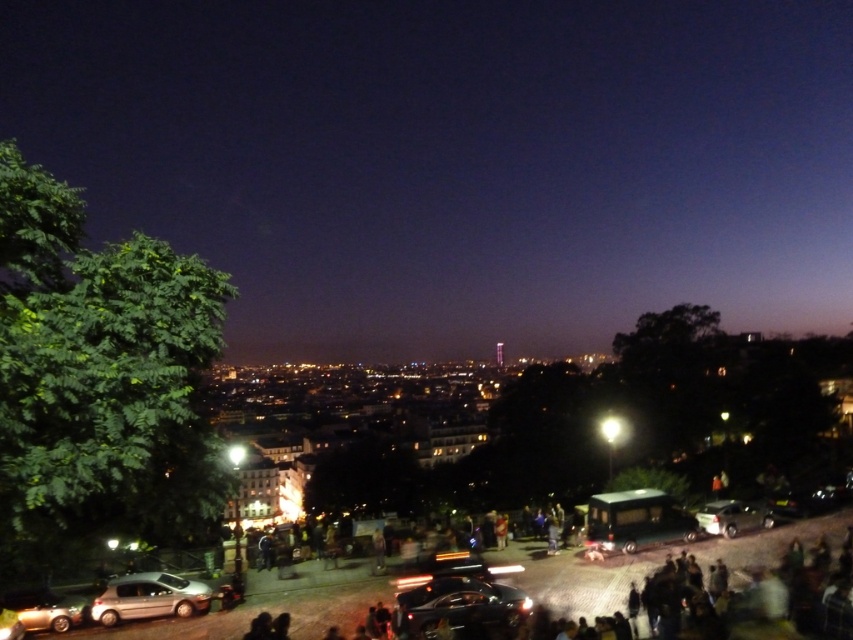
Looking at this image, does glossy black car at lower center have a greater width compared to silver metallic hatchback at lower left?

Indeed, glossy black car at lower center has a greater width compared to silver metallic hatchback at lower left.

Which is more to the right, glossy black car at lower center or silver metallic hatchback at lower left?

glossy black car at lower center is more to the right.

Which is behind, point (428, 634) or point (184, 580)?

The point (184, 580) is behind.

The width and height of the screenshot is (853, 640). Find the location of `glossy black car at lower center`. glossy black car at lower center is located at coordinates (456, 605).

Does silver metallic hatchback at lower left appear under metallic silver car at lower right?

Correct, silver metallic hatchback at lower left is located below metallic silver car at lower right.

Measure the distance from silver metallic hatchback at lower left to metallic silver car at lower right.

silver metallic hatchback at lower left is 45.97 meters away from metallic silver car at lower right.

Who is more distant from viewer, [206,592] or [727,529]?

Positioned behind is point [727,529].

This screenshot has width=853, height=640. I want to click on silver metallic hatchback at lower left, so click(149, 596).

Measure the distance between glossy black car at lower center and metallic silver car at lower right.

85.93 feet

Does glossy black car at lower center have a larger size compared to metallic silver car at lower right?

Correct, glossy black car at lower center is larger in size than metallic silver car at lower right.

Which is behind, point (492, 584) or point (723, 508)?

The point (723, 508) is more distant.

I want to click on glossy black car at lower center, so click(x=456, y=605).